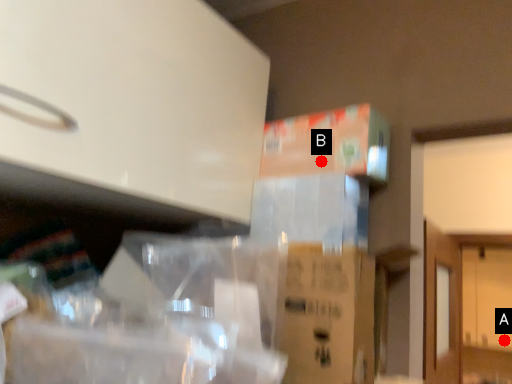
Question: Two points are circled on the image, labeled by A and B beside each circle. Which point is farther to the camera?

Choices:
 (A) A is further
 (B) B is further

Answer: (A)